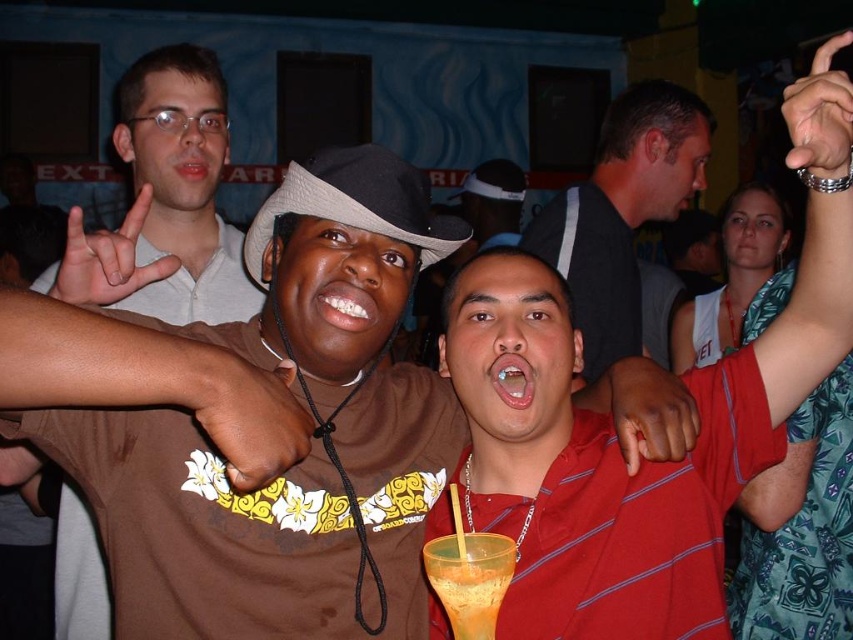
You are at a party and want to take a photo of the two people in the red striped polo shirt at center and smooth red shirt at center. Which one will appear closer to the camera in the photo?

The red striped polo shirt at center is in front of the smooth red shirt at center, so it will appear closer to the camera in the photo.

In the lively social scene, there are two objects of interest. You notice a matte skin hand at upper left and a silver metallic ring at upper right. From the perspective of someone standing in the scene, which object is positioned to the left?

The matte skin hand at upper left is positioned to the left of the silver metallic ring at upper right.

You are a photographer at the party and want to capture both the red striped polo shirt at center and the smooth red shirt at center in a single frame. Which person should stand closer to the camera to ensure both fit in the photo?

The red striped polo shirt at center has a larger width than the smooth red shirt at center, so the person wearing the red striped polo shirt at center should stand closer to the camera to ensure both fit in the photo.